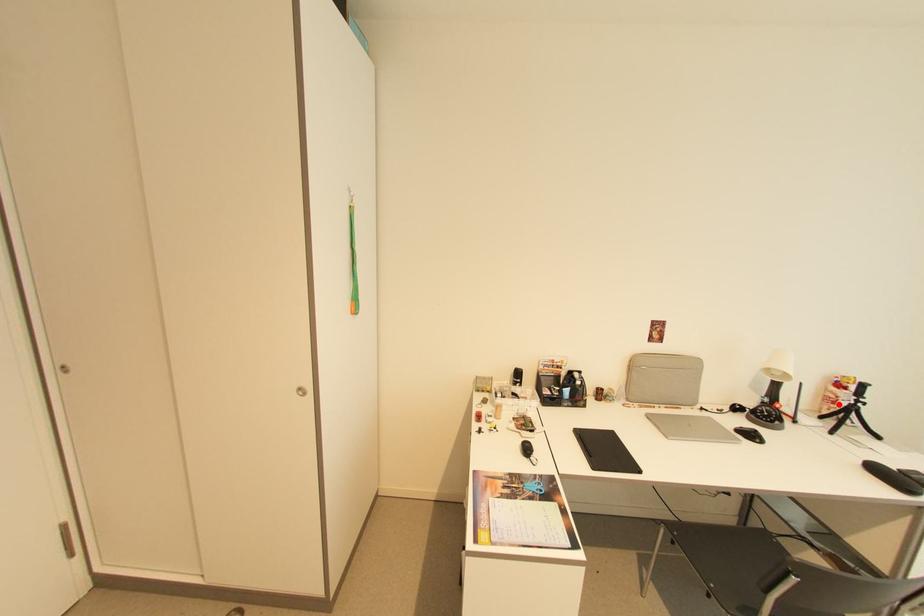
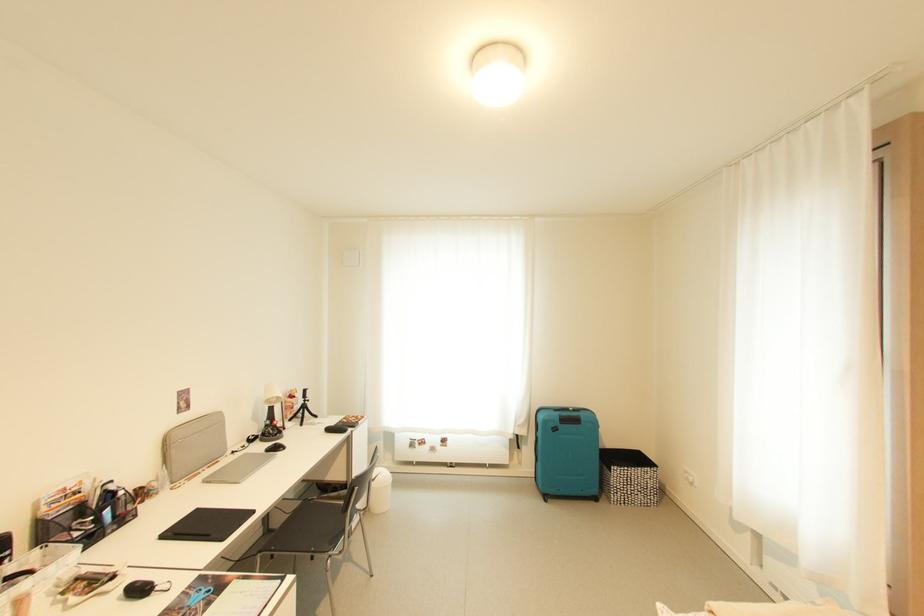
Question: I am providing you with two images of the same scene from different viewpoints. In image1, a red point is highlighted. Considering the same 3D point in image2, which of the following is correct?

Choices:
 (A) It is closer
 (B) It is farther

Answer: (B)